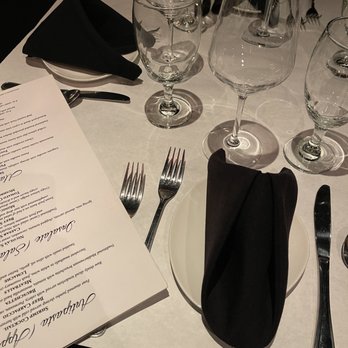
Where is `plates`? This screenshot has height=348, width=348. plates is located at coordinates (182, 230), (76, 76).